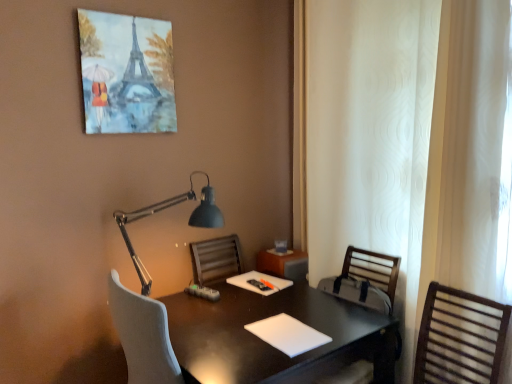
Question: From a real-world perspective, is wooden slatted chair at right, the first chair from the back, located beneath white matte notepad at center, acting as the first notepad starting from the back?

Choices:
 (A) yes
 (B) no

Answer: (A)

Question: From the image's perspective, is wooden slatted chair at right, placed as the second chair when sorted from front to back, over white matte notepad at center, the 1th notepad from the top?

Choices:
 (A) yes
 (B) no

Answer: (B)

Question: Is wooden slatted chair at right, the first chair from the back, positioned with its back to white matte notepad at center, which is the 2th notepad from front to back?

Choices:
 (A) no
 (B) yes

Answer: (A)

Question: Is wooden slatted chair at right, placed as the second chair when sorted from front to back, positioned beyond the bounds of white matte notepad at center, the 1th notepad from the top?

Choices:
 (A) yes
 (B) no

Answer: (A)

Question: Can you confirm if wooden slatted chair at right, placed as the second chair when sorted from front to back, is thinner than white matte notepad at center, which is the 2th notepad from front to back?

Choices:
 (A) yes
 (B) no

Answer: (B)

Question: Is the depth of wooden slatted chair at right, the first chair from the back, greater than that of white matte notepad at center, the 1th notepad from the top?

Choices:
 (A) yes
 (B) no

Answer: (B)

Question: From a real-world perspective, is brown wooden chair at right, placed as the second chair when sorted from back to front, under matte black lamp at upper center?

Choices:
 (A) no
 (B) yes

Answer: (B)

Question: Does brown wooden chair at right, placed as the second chair when sorted from back to front, have a lesser height compared to matte black lamp at upper center?

Choices:
 (A) yes
 (B) no

Answer: (A)

Question: Does brown wooden chair at right, the 1th chair when ordered from front to back, appear on the left side of matte black lamp at upper center?

Choices:
 (A) no
 (B) yes

Answer: (A)

Question: Is brown wooden chair at right, the 1th chair when ordered from front to back, far from matte black lamp at upper center?

Choices:
 (A) yes
 (B) no

Answer: (A)

Question: Is brown wooden chair at right, placed as the second chair when sorted from back to front, next to matte black lamp at upper center and touching it?

Choices:
 (A) yes
 (B) no

Answer: (B)

Question: Considering the relative sizes of brown wooden chair at right, the 1th chair when ordered from front to back, and matte black lamp at upper center in the image provided, is brown wooden chair at right, the 1th chair when ordered from front to back, bigger than matte black lamp at upper center?

Choices:
 (A) yes
 (B) no

Answer: (B)

Question: Does black glossy desk at center contain white matte notepad at center, positioned as the 2th notepad in back-to-front order?

Choices:
 (A) no
 (B) yes

Answer: (B)